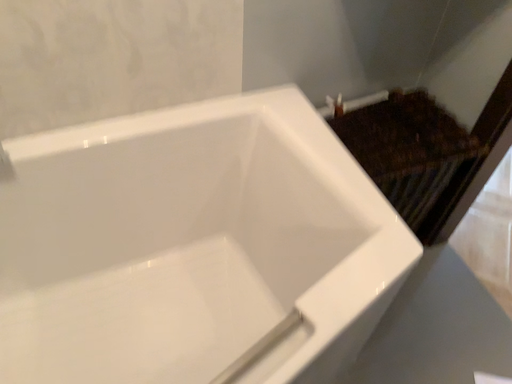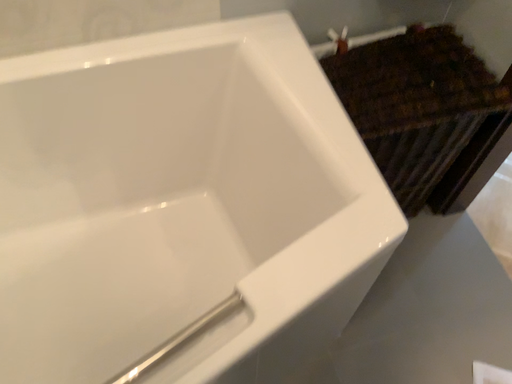
Question: How did the camera likely rotate when shooting the video?

Choices:
 (A) rotated upward
 (B) rotated downward

Answer: (B)